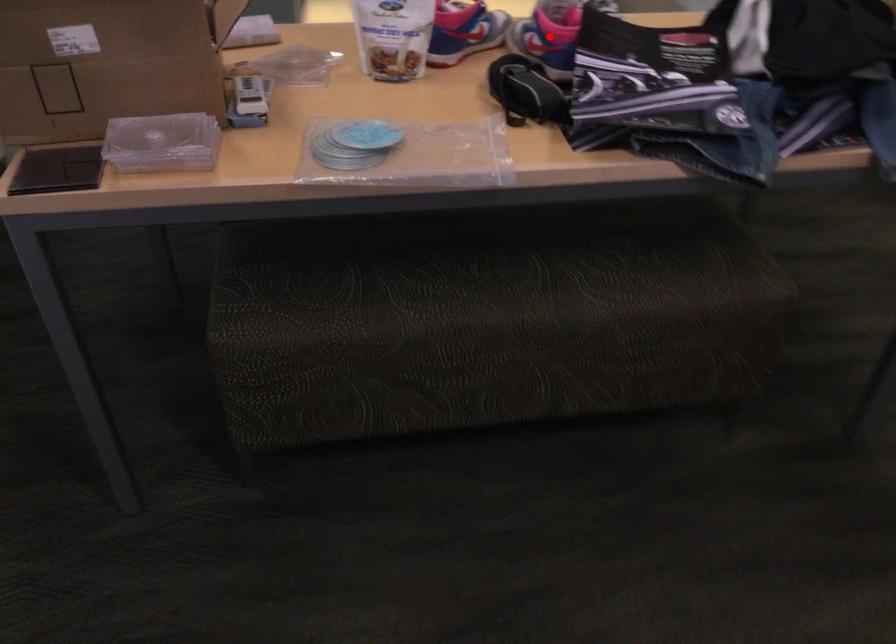
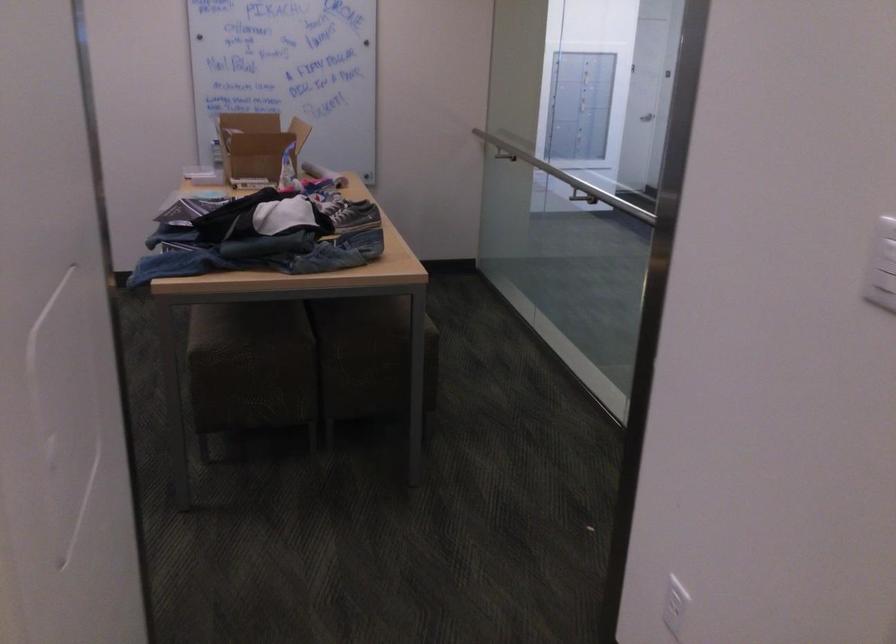
Question: I am providing you with two images of the same scene from different viewpoints. A red point is marked on the first image. At the location where the point appears in image 1, is it still visible in image 2?

Choices:
 (A) Yes
 (B) No

Answer: (B)